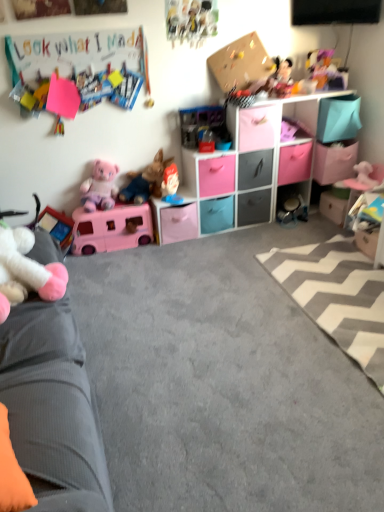
Question: Is gray/white zigzag rug at lower right bigger or smaller than gray matte drawer at center, placed as the 2th drawer when sorted from right to left?

Choices:
 (A) big
 (B) small

Answer: (A)

Question: From the image's perspective, is gray/white zigzag rug at lower right above or below gray matte drawer at center, marked as the sixth drawer in a left-to-right arrangement?

Choices:
 (A) above
 (B) below

Answer: (B)

Question: Considering the real-world distances, which object is closest to the shiny plastic doll at upper right, which is the 3th toy in right-to-left order?

Choices:
 (A) matte plastic storage unit at upper center
 (B) matte gray drawer at center, which is counted as the fifth drawer, starting from the left
 (C) white plush toy at left, the first toy positioned from the left
 (D) matte plastic figurine at center, the 5th toy viewed from the left
 (E) brown plush toy at center, which is the sixth toy in right-to-left order

Answer: (A)

Question: Which is farther from the orange fabric pillow at lower left?

Choices:
 (A) plush mickey mouse at upper right, the 8th toy positioned from the left
 (B) brown plush toy at center, which is the sixth toy in right-to-left order
 (C) white glossy drawer at lower right, placed as the 1th drawer when sorted from right to left
 (D) matte plastic figurine at center, the fifth toy viewed from the right
 (E) gray/white zigzag rug at lower right

Answer: (A)